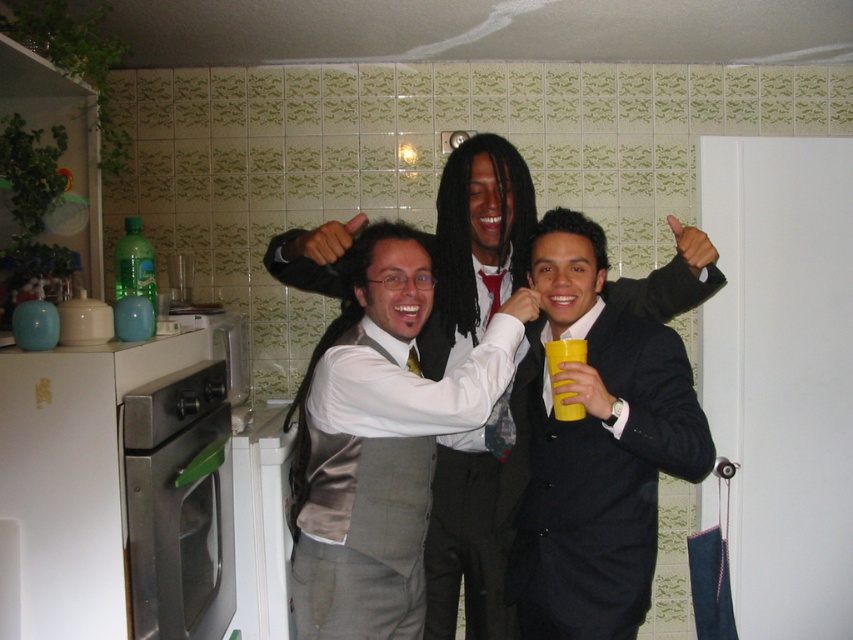
From the picture: You are organizing a formal event and need to ensure that the satin gray vest at center and the black satin suit at center can be displayed side by side on a mannequin. Given that the mannequin has a width of 30 cm, will both items fit comfortably without overlapping?

The satin gray vest at center is larger than the black satin suit at center. However, since the mannequin is 30 cm wide, both items can be displayed side by side as long as their combined width does not exceed the mannequin width. Unfortunately, the exact dimensions of each item are not provided, so it is uncertain if they will fit without overlapping.

You are standing in the kitchen and see a point marked at coordinates (379, 440). Which object in the scene does this point lie on?

The point at coordinates (379, 440) lies on the satin gray vest at center.

You are a guest at a party and see the green plastic bottle at left and the yellow matte cup at center. Which one is more to the left?

The green plastic bottle at left is more to the left than the yellow matte cup at center.